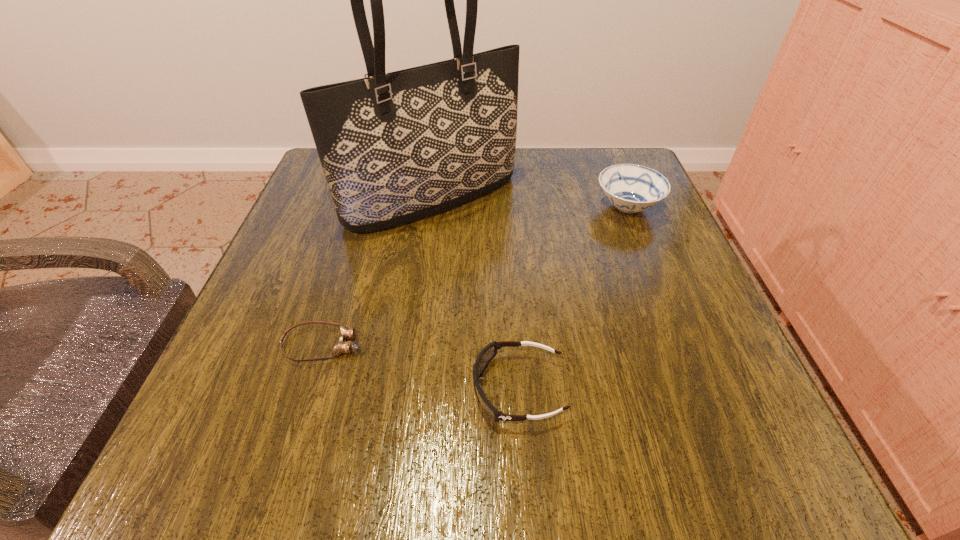
This screenshot has width=960, height=540. What are the coordinates of `blank space that satisfies the following two spatial constraints: 1. on the front side of the tote bag; 2. on the front lenses and sides of the shortest object` in the screenshot? It's located at (413, 345).